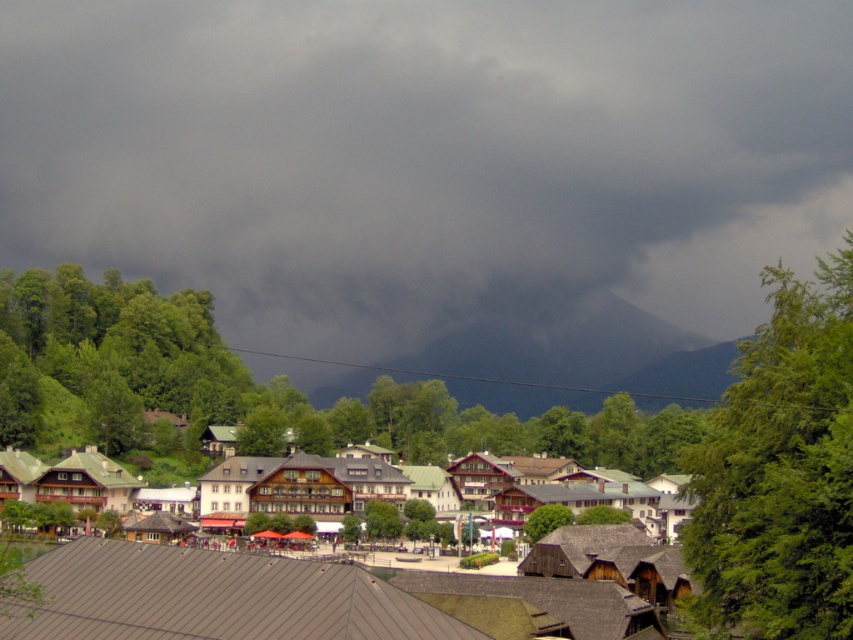
In the scene shown: You are an artist planning to paint the village scene. You want to ensure the dark gray cloud at upper center and the dark gray rock at center are proportionally accurate. Which object should you make wider in your painting?

The dark gray cloud at upper center should be made wider in the painting since its width is larger than the dark gray rock at center.

You are a visitor standing in the village square looking towards the mountain. You notice the dark gray cloud at upper center and the wooden houses at center. Which object is higher in the sky?

The dark gray cloud at upper center is higher in the sky than the wooden houses at center because it is positioned above them.